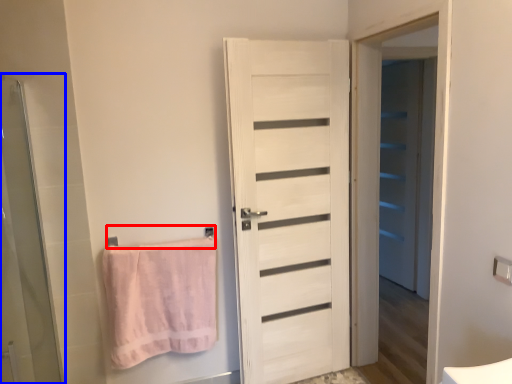
Question: Among these objects, which one is farthest to the camera, towel bar (highlighted by a red box) or screen door (highlighted by a blue box)?

Choices:
 (A) towel bar
 (B) screen door

Answer: (A)